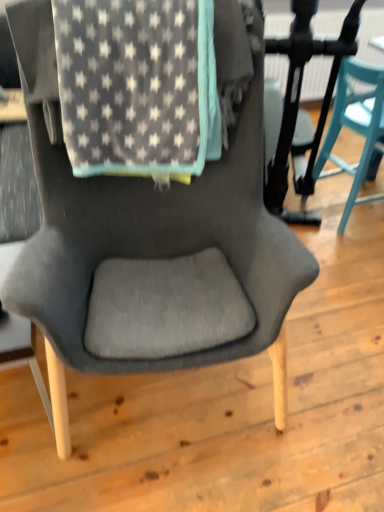
Question: Considering the positions of gray star-patterned blanket at upper center and teal plastic chair at right in the image, is gray star-patterned blanket at upper center taller or shorter than teal plastic chair at right?

Choices:
 (A) tall
 (B) short

Answer: (B)

Question: From the image's perspective, is gray star-patterned blanket at upper center above or below teal plastic chair at right?

Choices:
 (A) above
 (B) below

Answer: (B)

Question: Is gray star-patterned blanket at upper center in front of or behind teal plastic chair at right in the image?

Choices:
 (A) front
 (B) behind

Answer: (A)

Question: In the image, is teal plastic chair at right positioned in front of or behind gray star-patterned blanket at upper center?

Choices:
 (A) behind
 (B) front

Answer: (A)

Question: From a real-world perspective, is teal plastic chair at right physically located above or below gray star-patterned blanket at upper center?

Choices:
 (A) below
 (B) above

Answer: (A)

Question: In the image, is teal plastic chair at right on the left side or the right side of gray star-patterned blanket at upper center?

Choices:
 (A) right
 (B) left

Answer: (A)

Question: Would you say teal plastic chair at right is inside or outside gray star-patterned blanket at upper center?

Choices:
 (A) inside
 (B) outside

Answer: (B)